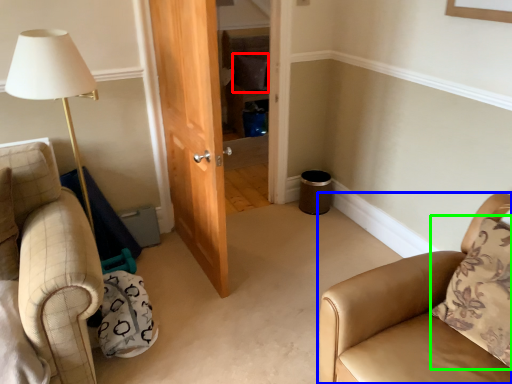
Question: Estimate the real-world distances between objects in this image. Which object is farther from pillow (highlighted by a red box), chair (highlighted by a blue box) or pillow (highlighted by a green box)?

Choices:
 (A) chair
 (B) pillow

Answer: (B)